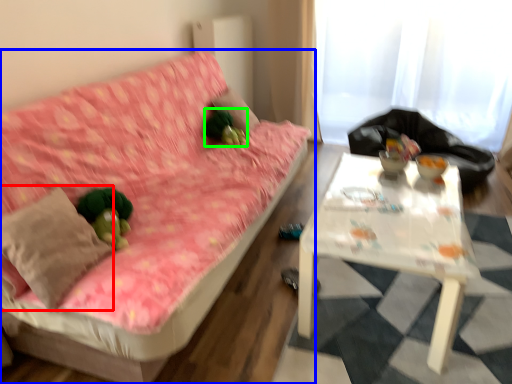
Question: Estimate the real-world distances between objects in this image. Which object is closer to throw pillow (highlighted by a red box), studio couch (highlighted by a blue box) or toy (highlighted by a green box)?

Choices:
 (A) studio couch
 (B) toy

Answer: (A)